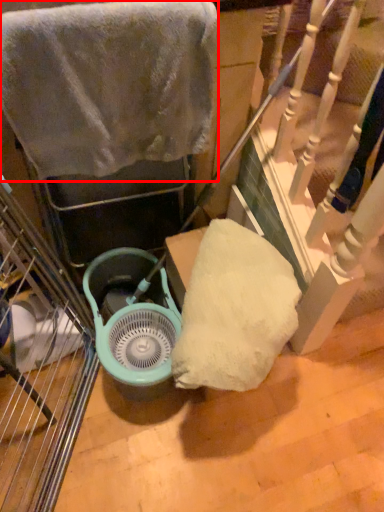
Question: Considering the relative positions of towel (annotated by the red box) and fan in the image provided, where is towel (annotated by the red box) located with respect to the staircase?

Choices:
 (A) right
 (B) left

Answer: (A)